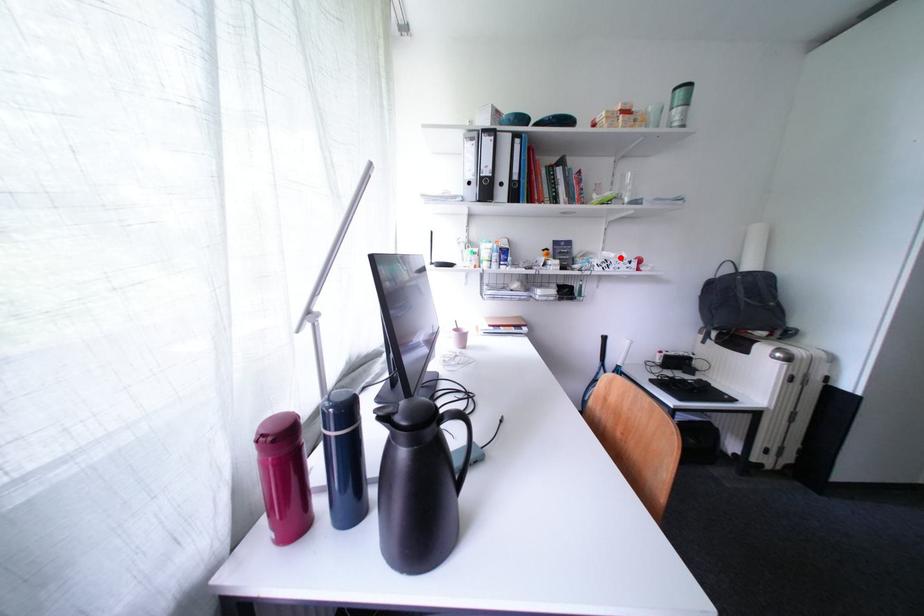
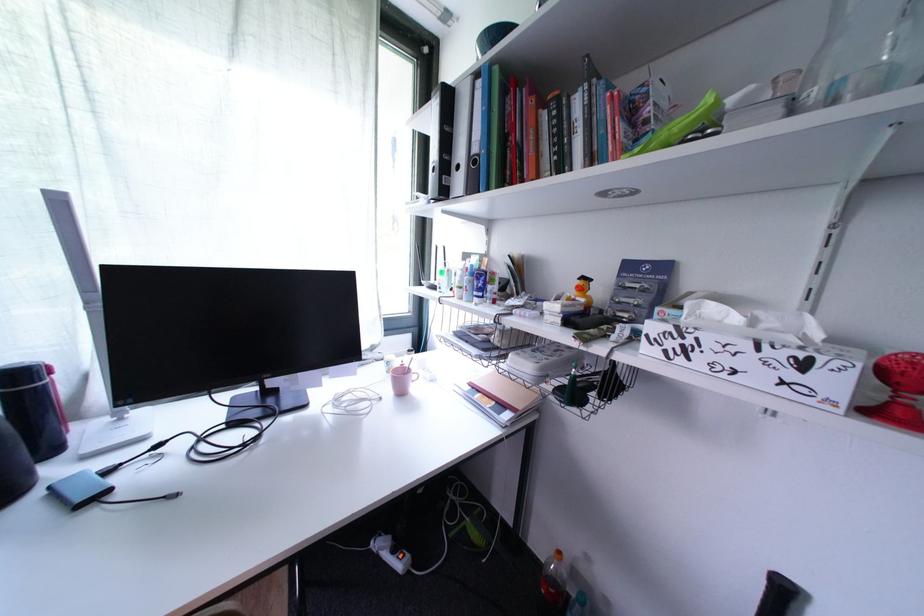
In the second image, find the point that corresponds to the highlighted location in the first image.

(745, 321)